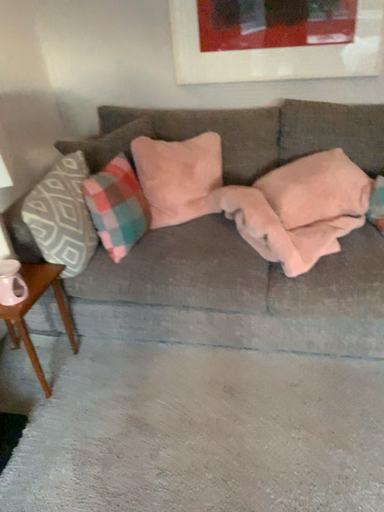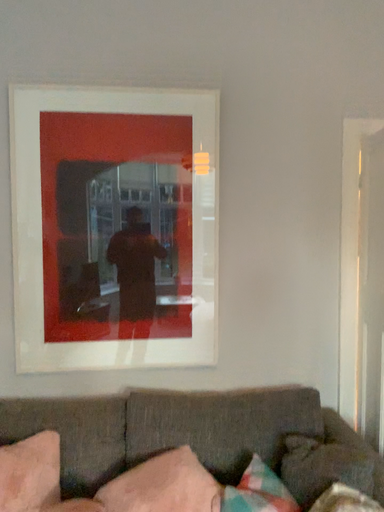
Question: How did the camera likely rotate when shooting the video?

Choices:
 (A) rotated right
 (B) rotated left

Answer: (A)